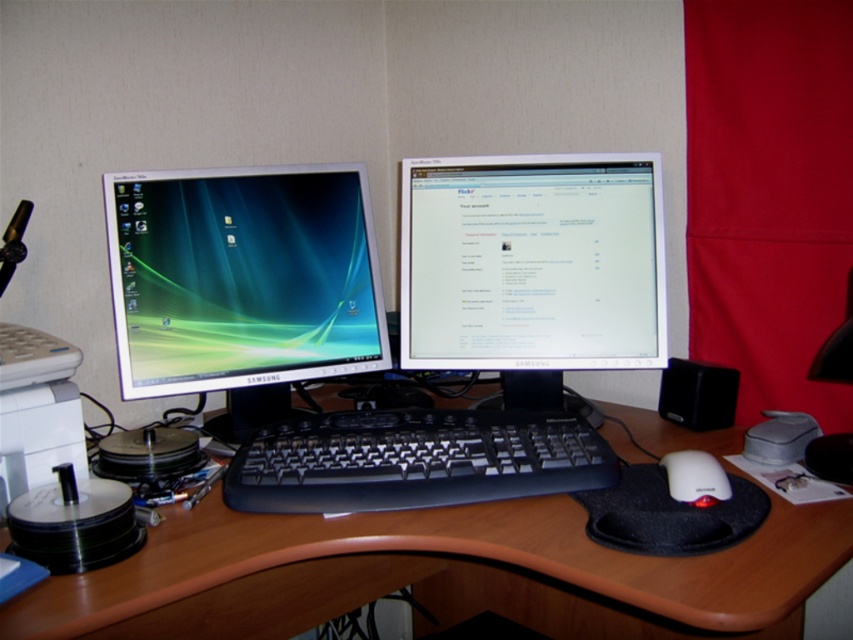
Consider the image. You are setting up a new computer mouse and want to place it near the matte plastic monitor at left and the black plastic keyboard at center. Based on their positions, which side of the keyboard should you place the mouse to avoid blocking the monitor?

The matte plastic monitor at left is to the left of the black plastic keyboard at center, so placing the mouse to the right side of the keyboard would avoid blocking the monitor.

You need to place a new wireless charger exactly between the matte plastic monitor at left and the black computer mouse with red accents. What coordinate should you aim for?

The matte plastic monitor at left is located at point [242,276]. To determine the midpoint between it and the black computer mouse with red accents, you would need the mouse coordinates, which are not provided. Without this information, an accurate coordinate cannot be calculated.

You are setting up a new monitor for your home office. You have a matte plastic monitor at left and a black plastic keyboard at center. Which object is bigger in size?

The matte plastic monitor at left is larger in size compared to the black plastic keyboard at center.